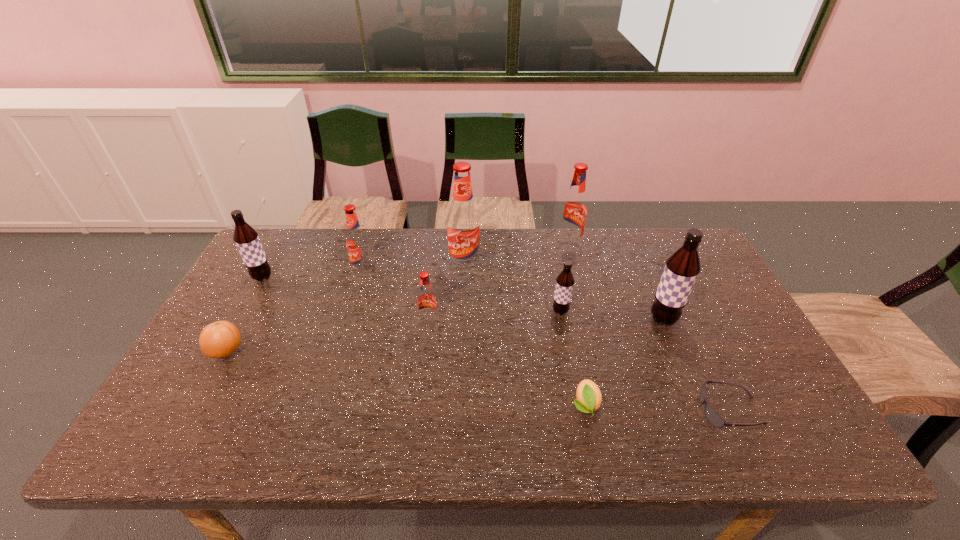
At what (x,y) coordinates should I click in order to perform the action: click on vacant space at the left edge of the desktop. Please return your answer as a coordinate pair (x, y). This screenshot has height=540, width=960. Looking at the image, I should click on [x=276, y=283].

Locate an element on the screen. The width and height of the screenshot is (960, 540). free space at the right edge is located at coordinates (760, 365).

Locate an element on the screen. The height and width of the screenshot is (540, 960). vacant region at the near left corner of the desktop is located at coordinates (193, 423).

Image resolution: width=960 pixels, height=540 pixels. I want to click on vacant space at the far right corner, so [x=650, y=231].

Identify the location of free space at the near right corner of the desktop. The height and width of the screenshot is (540, 960). (784, 423).

Locate an element on the screen. free spot between the fifth root beer from right to left and the yellow lemon is located at coordinates (507, 363).

Identify the location of empty space between the third root beer from right to left and the fourth root beer from right to left. The width and height of the screenshot is (960, 540). (513, 289).

Find the location of a particular element. free space between the biggest brown root beer and the second root beer from left to right is located at coordinates (513, 295).

Find the location of a particular element. vacant point located between the leftmost root beer and the sixth root beer from left to right is located at coordinates (416, 261).

Identify the location of empty space that is in between the shortest object and the leftmost red root beer. (546, 341).